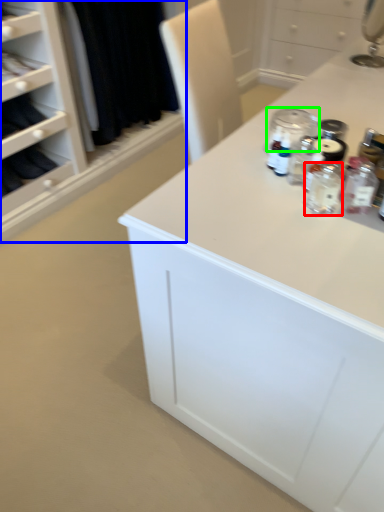
Question: Considering the real-world distances, which object is closest to bottle (highlighted by a red box)? closet (highlighted by a blue box) or glass jar (highlighted by a green box).

Choices:
 (A) closet
 (B) glass jar

Answer: (B)